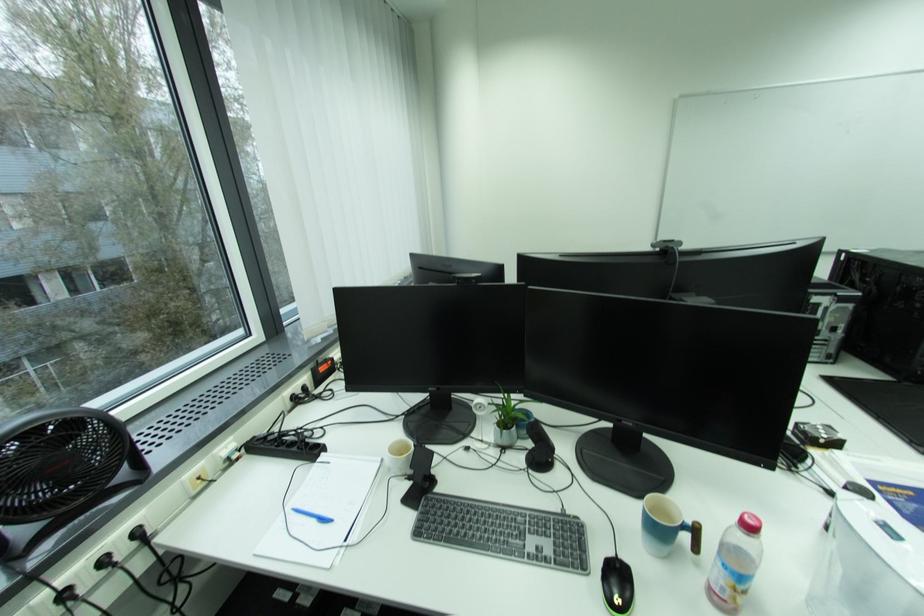
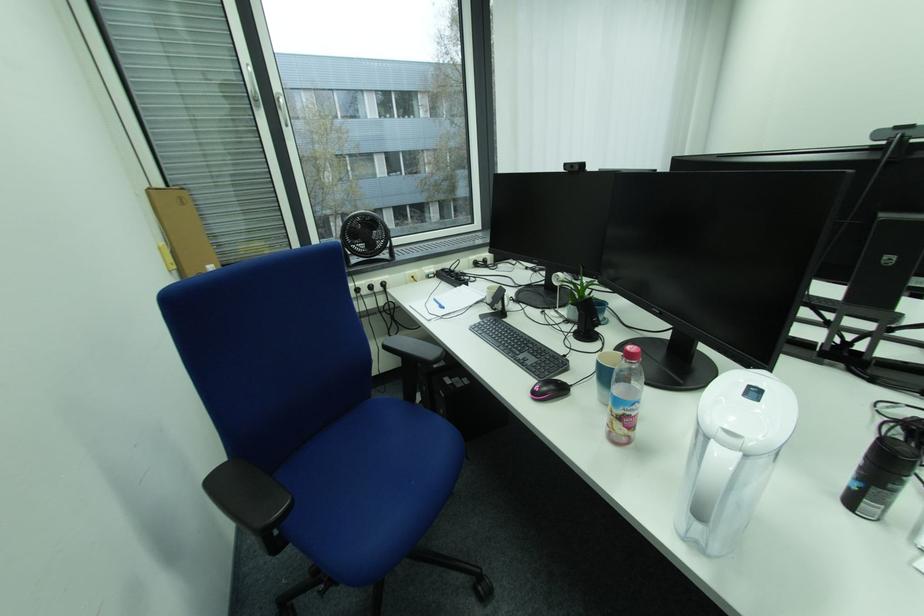
Locate, in the second image, the point that corresponds to (x=760, y=522) in the first image.

(638, 350)